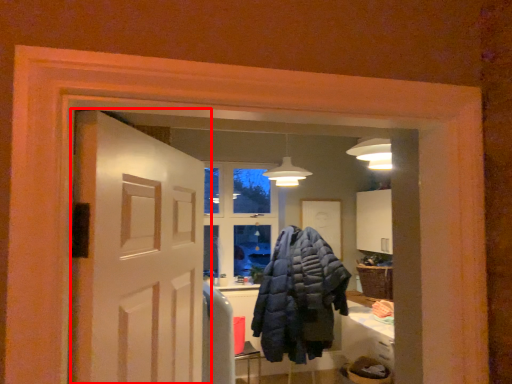
Question: From the image's perspective, what is the correct spatial positioning of door (annotated by the red box) in reference to jacket?

Choices:
 (A) above
 (B) below

Answer: (A)